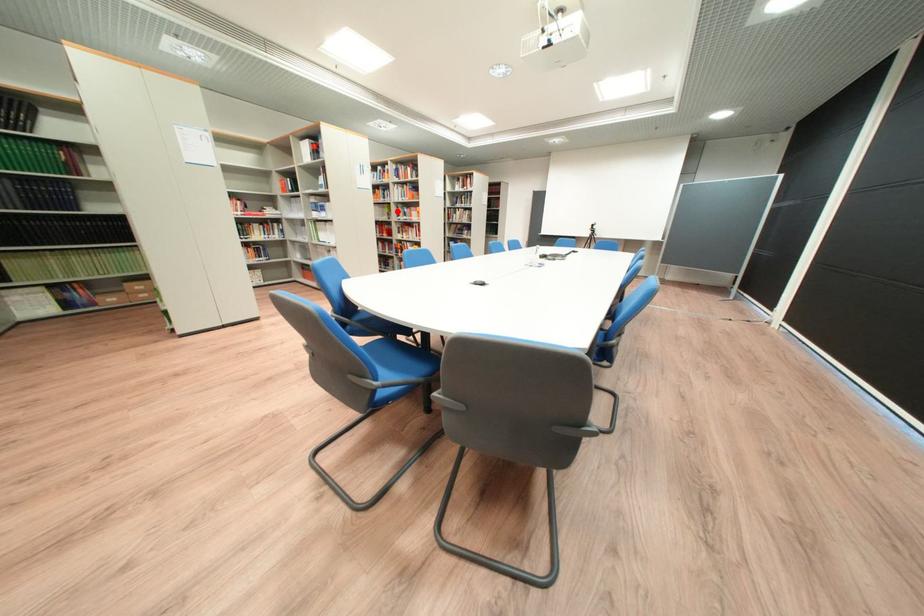
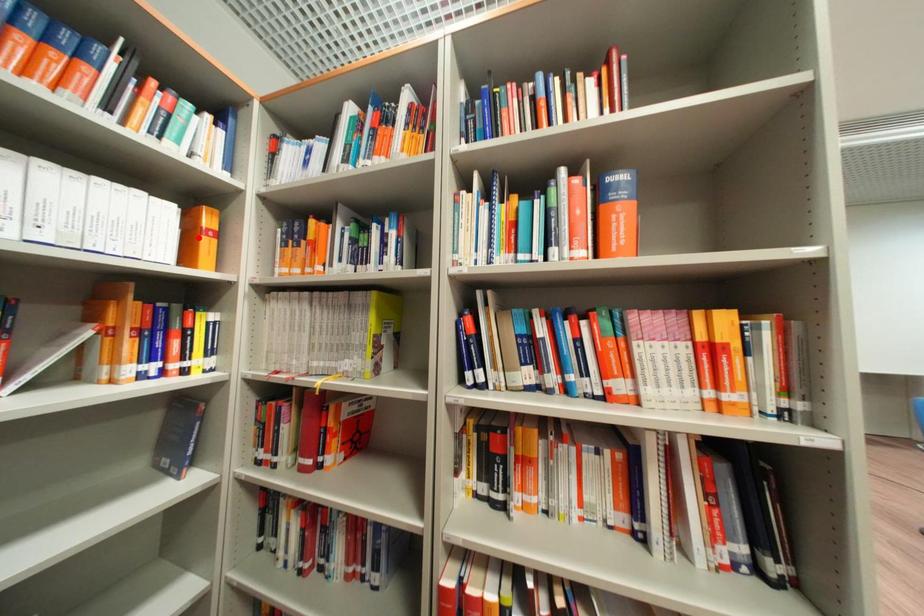
I am providing you with two images of the same scene from different viewpoints. A red point is marked on the first image and another point is marked on the second image. Are the points marked in image1 and image2 representing the same 3D position?

No